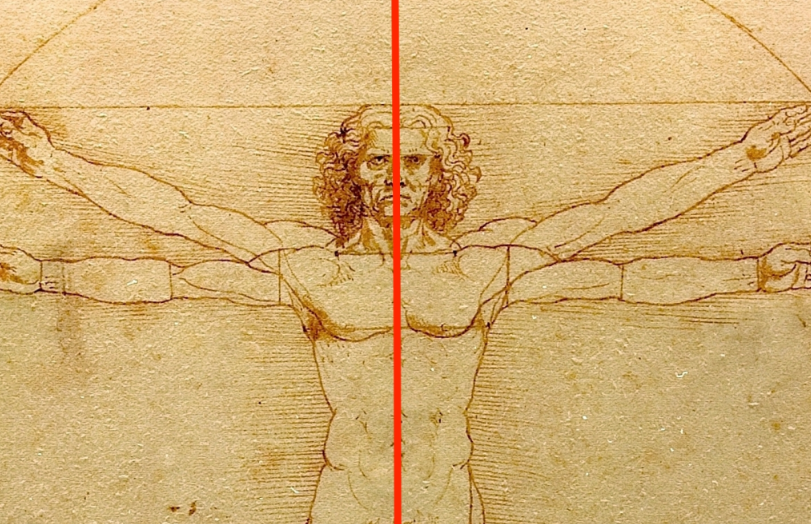
Where is `the chest`? This screenshot has height=524, width=811. the chest is located at coordinates (366, 313).